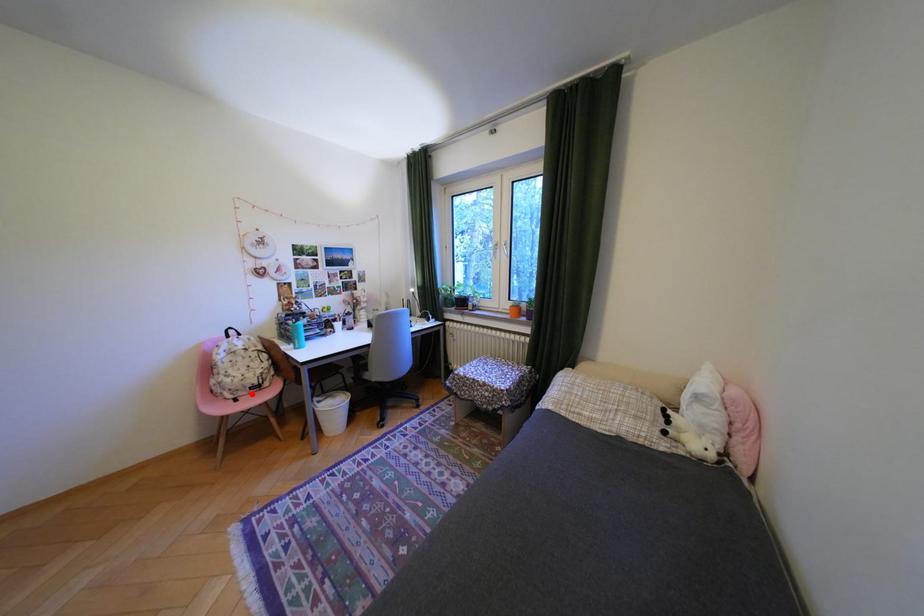
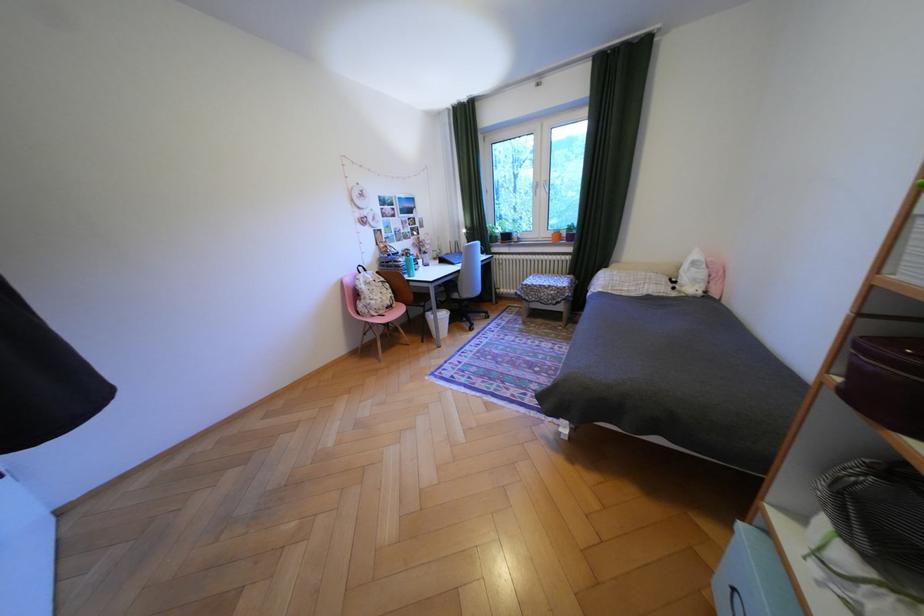
Question: I am providing you with two images of the same scene from different viewpoints. In image1, a red point is highlighted. Considering the same 3D point in image2, which of the following is correct?

Choices:
 (A) It is closer
 (B) It is farther

Answer: (A)